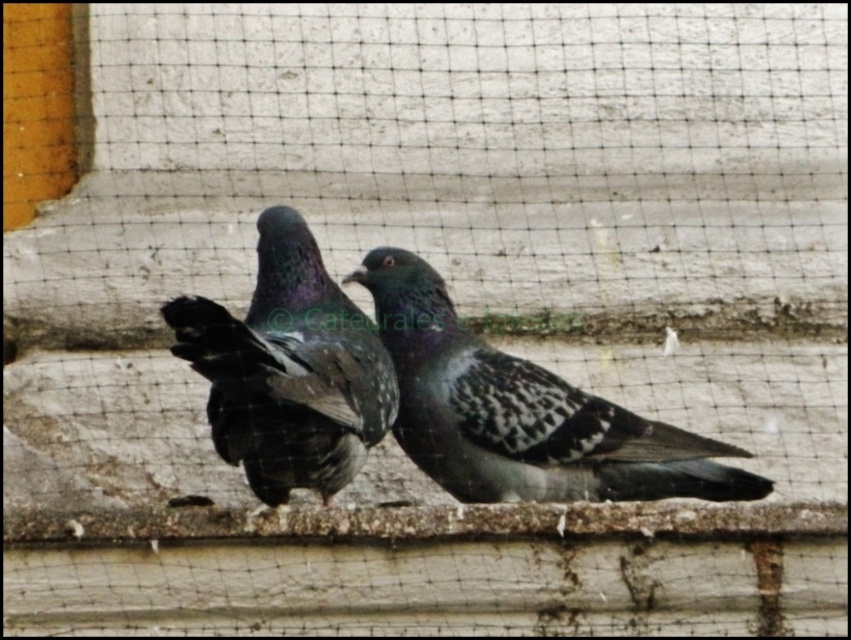
Question: In this image, where is speckled feathered pigeon at center located relative to shiny dark feathers at center?

Choices:
 (A) above
 (B) below

Answer: (B)

Question: Is speckled feathered pigeon at center thinner than shiny dark feathers at center?

Choices:
 (A) no
 (B) yes

Answer: (A)

Question: Among these objects, which one is nearest to the camera?

Choices:
 (A) shiny dark feathers at center
 (B) speckled feathered pigeon at center

Answer: (A)

Question: Which of the following is the farthest from the observer?

Choices:
 (A) shiny dark feathers at center
 (B) speckled feathered pigeon at center

Answer: (B)

Question: Can you confirm if speckled feathered pigeon at center is positioned to the left of shiny dark feathers at center?

Choices:
 (A) yes
 (B) no

Answer: (B)

Question: Which of the following is the closest to the observer?

Choices:
 (A) speckled feathered pigeon at center
 (B) shiny dark feathers at center

Answer: (B)